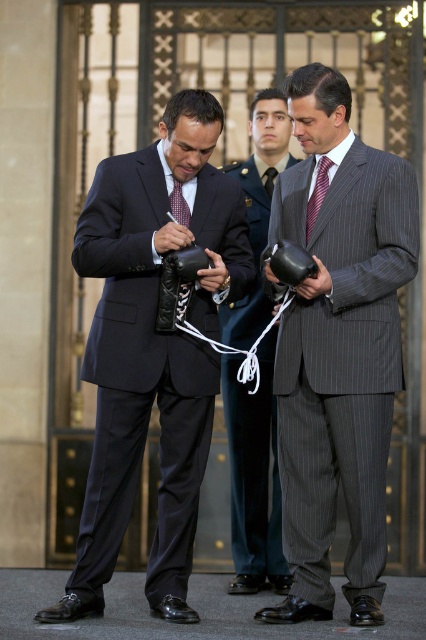
Based on the scene description, what are the coordinates of the matte black suit at center?

The coordinates of the matte black suit at center are at point (152,349).

You are a photographer positioned at the back of the room. You need to take a photo of both the matte black suit at center and the pinstriped suit at center. Can you fit both subjects into the frame of your camera, which has a maximum horizontal field of view of 5 meters?

The matte black suit at center and pinstriped suit at center are 4.84 meters apart. Since the distance between them is less than the camera frame width of 5 meters, both subjects can be captured in the same frame.